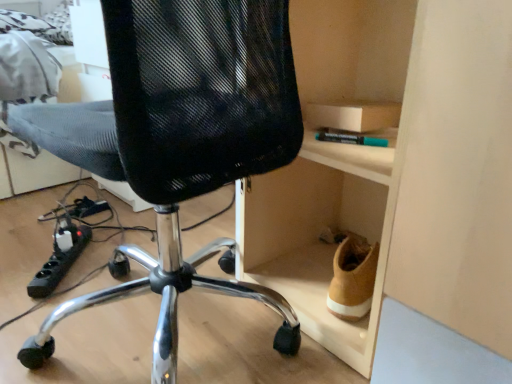
Question: In terms of width, does black mesh chair at center look wider or thinner when compared to black plastic power strip at lower left?

Choices:
 (A) wide
 (B) thin

Answer: (A)

Question: Relative to black plastic power strip at lower left, is black mesh chair at center in front or behind?

Choices:
 (A) behind
 (B) front

Answer: (B)

Question: Based on their relative distances, which object is farther from the black mesh chair at center?

Choices:
 (A) black plastic power strip at lower left
 (B) wooden cabinet at right

Answer: (A)

Question: Based on their relative distances, which object is farther from the black plastic power strip at lower left?

Choices:
 (A) black mesh chair at center
 (B) wooden cabinet at right

Answer: (B)